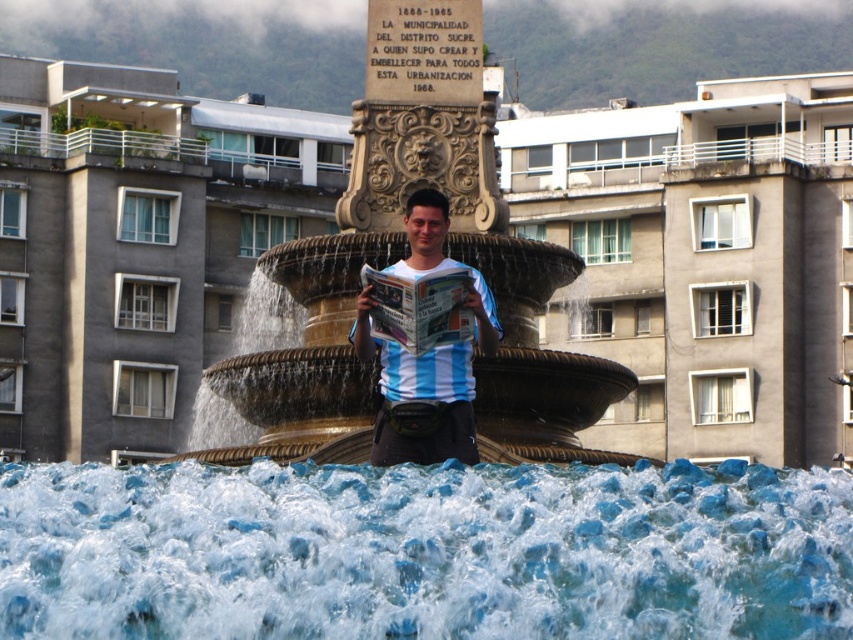
Question: Does gold ornate fountain at center appear on the right side of blue striped shirt at center?

Choices:
 (A) yes
 (B) no

Answer: (B)

Question: Does gold ornate fountain at center appear on the left side of blue striped shirt at center?

Choices:
 (A) yes
 (B) no

Answer: (A)

Question: Is gold ornate fountain at center wider than blue striped shirt at center?

Choices:
 (A) yes
 (B) no

Answer: (A)

Question: Which point is farther to the camera?

Choices:
 (A) gold ornate fountain at center
 (B) clear water at fountain center
 (C) blue striped shirt at center

Answer: (A)

Question: Which object is farther from the camera taking this photo?

Choices:
 (A) gold ornate fountain at center
 (B) clear water at fountain center

Answer: (A)

Question: Which is nearer to the gold ornate fountain at center?

Choices:
 (A) clear water at fountain center
 (B) blue striped shirt at center

Answer: (B)